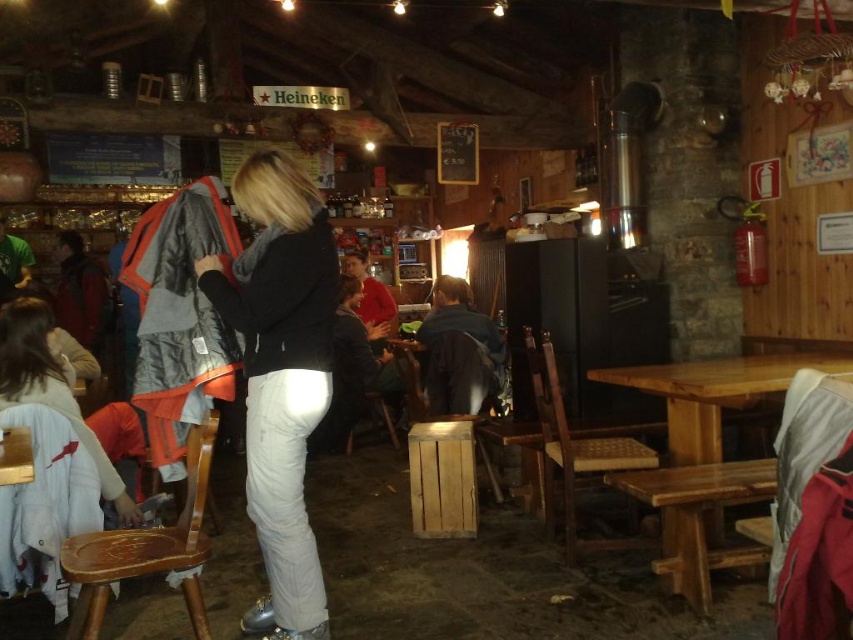
Does point (277, 472) come closer to viewer compared to point (645, 488)?

Yes.

You are a GUI agent. You are given a task and a screenshot of the screen. Output one action in this format:
    pyautogui.click(x=<x>, y=<y>)
    Task: Click on the white matte pants at center
    This screenshot has width=853, height=640.
    Given the screenshot: What is the action you would take?
    pyautogui.click(x=281, y=376)